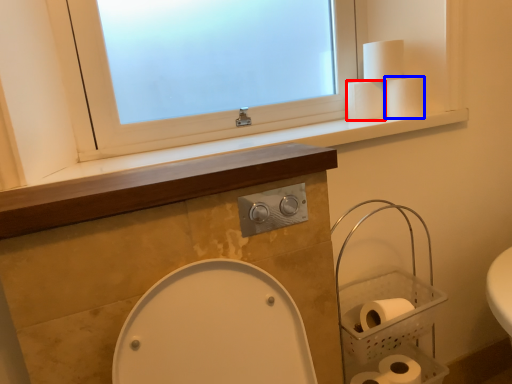
Question: Which of the following is the farthest to the observer, toilet paper (highlighted by a red box) or toilet paper (highlighted by a blue box)?

Choices:
 (A) toilet paper
 (B) toilet paper

Answer: (A)